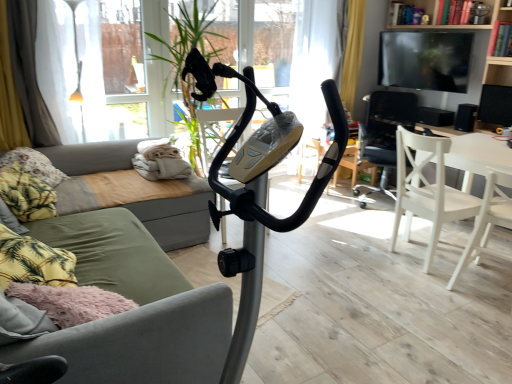
Where is `free point above black glossy tv at upper right (from a real-world perspective)`? free point above black glossy tv at upper right (from a real-world perspective) is located at coordinates (426, 24).